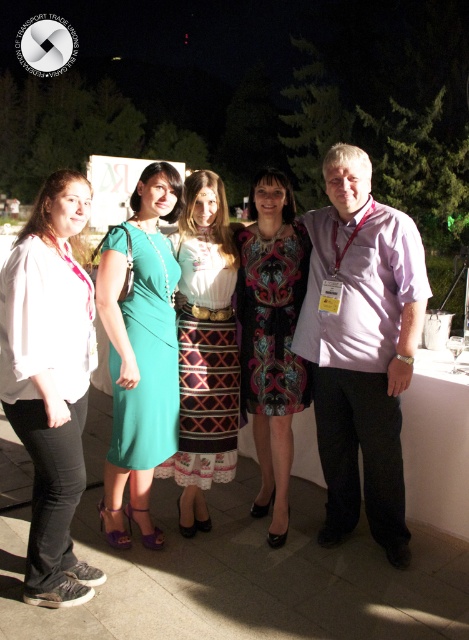
Consider the image. You are a photographer at the event and need to adjust the lighting so that both the matte white shirt at left and the patterned fabric skirt at center are well illuminated. Considering their sizes, which object might require a wider light spread to ensure proper exposure?

The matte white shirt at left is not as tall as the patterned fabric skirt at center, so the patterned fabric skirt at center may need a wider light spread to accommodate its greater height.

Consider the image. You are organizing a photo shoot and need to arrange the models in order from left to right based on their clothing. Given the pink cotton shirt at center and the matte white shirt at left, which shirt should be placed to the left of the other?

The matte white shirt at left should be placed to the left of the pink cotton shirt at center because the pink cotton shirt at center is positioned on the right side of the matte white shirt at left.

You are standing at the point marked as point [416,324] in the image, which is 8.88 feet away from you. You want to take a photo of the group of five individuals. Is the distance sufficient to capture the entire group in the frame?

The distance of point [416,324] from viewer is 8.88 feet. This distance should be sufficient to capture the entire group of five individuals in the frame as they are likely within a reasonable field of view at that distance.